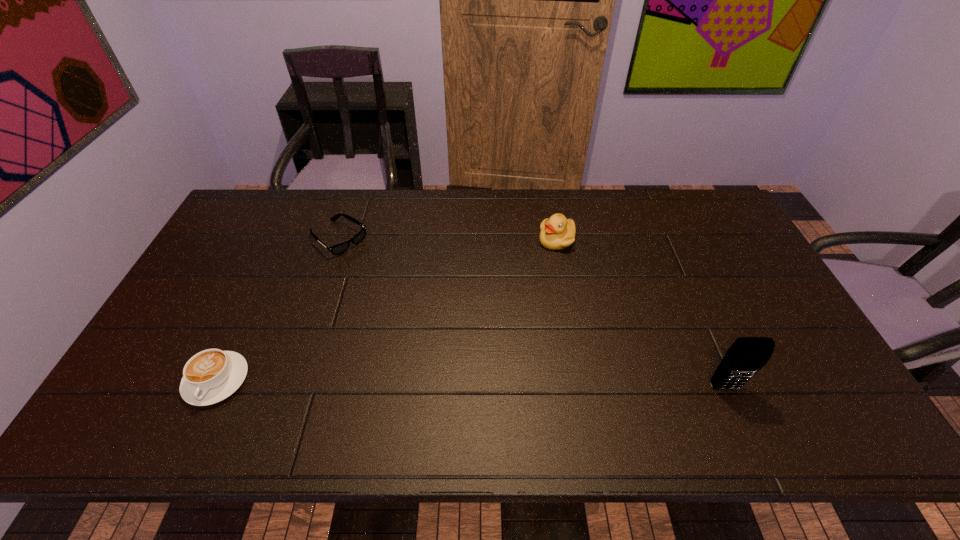
Locate an element on the screen. The width and height of the screenshot is (960, 540). vacant space located 0.100m on the front-facing side of the shortest object is located at coordinates (376, 267).

At what (x,y) coordinates should I click in order to perform the action: click on free space located on the front-facing side of the duckling. Please return your answer as a coordinate pair (x, y). Looking at the image, I should click on (539, 276).

This screenshot has width=960, height=540. Identify the location of free space located on the front-facing side of the duckling. (512, 327).

Locate an element on the screen. The height and width of the screenshot is (540, 960). free spot located on the front-facing side of the duckling is located at coordinates (546, 261).

Locate an element on the screen. This screenshot has height=540, width=960. sunglasses present at the far edge is located at coordinates (337, 249).

The image size is (960, 540). Find the location of `duckling situated at the far edge`. duckling situated at the far edge is located at coordinates (557, 232).

In order to click on cappuccino present at the near edge in this screenshot , I will do `click(210, 376)`.

Locate an element on the screen. The height and width of the screenshot is (540, 960). cellular telephone at the near edge is located at coordinates (746, 356).

I want to click on object at the left edge, so click(x=210, y=376).

This screenshot has height=540, width=960. Find the location of `object that is at the near left corner`. object that is at the near left corner is located at coordinates (210, 376).